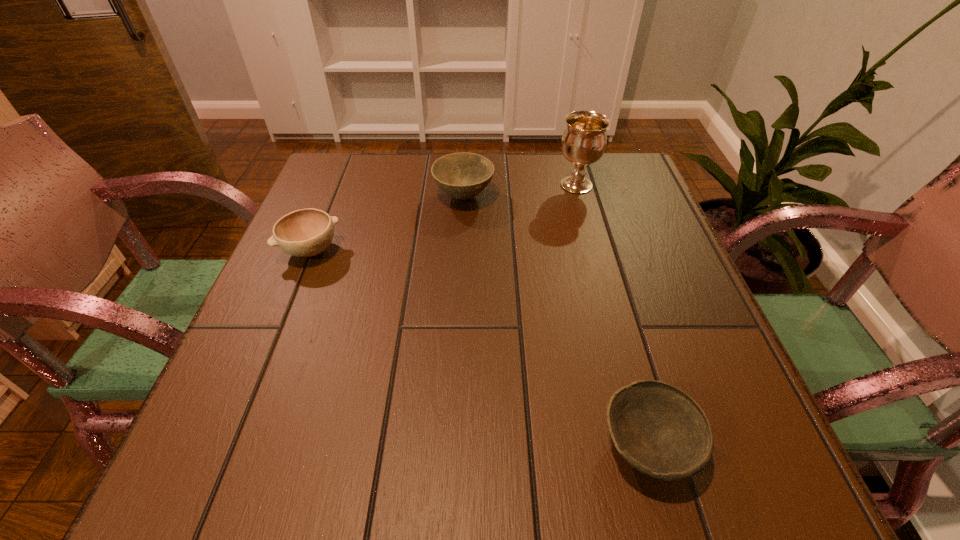
Find the location of `the tallest object`. the tallest object is located at coordinates (584, 140).

Locate an element on the screen. This screenshot has height=540, width=960. the second object from left to right is located at coordinates (462, 176).

This screenshot has height=540, width=960. I want to click on the farthest bowl, so click(462, 176).

This screenshot has height=540, width=960. What are the coordinates of `the leftmost object` in the screenshot? It's located at (308, 232).

In order to click on the leftmost bowl in this screenshot , I will do `click(308, 232)`.

This screenshot has width=960, height=540. I want to click on the nearest bowl, so click(661, 431).

At what (x,y) coordinates should I click in order to perform the action: click on the nearest object. Please return your answer as a coordinate pair (x, y). Looking at the image, I should click on (661, 431).

At what (x,y) coordinates should I click in order to perform the action: click on vacant space located 0.100m on the back of the tallest object. Please return your answer as a coordinate pair (x, y). The image size is (960, 540). Looking at the image, I should click on (568, 155).

The image size is (960, 540). I want to click on vacant space situated 0.170m on the front of the third object from right to left, so click(x=461, y=264).

The height and width of the screenshot is (540, 960). I want to click on blank space located 0.270m on the front of the third farthest object, so click(x=257, y=383).